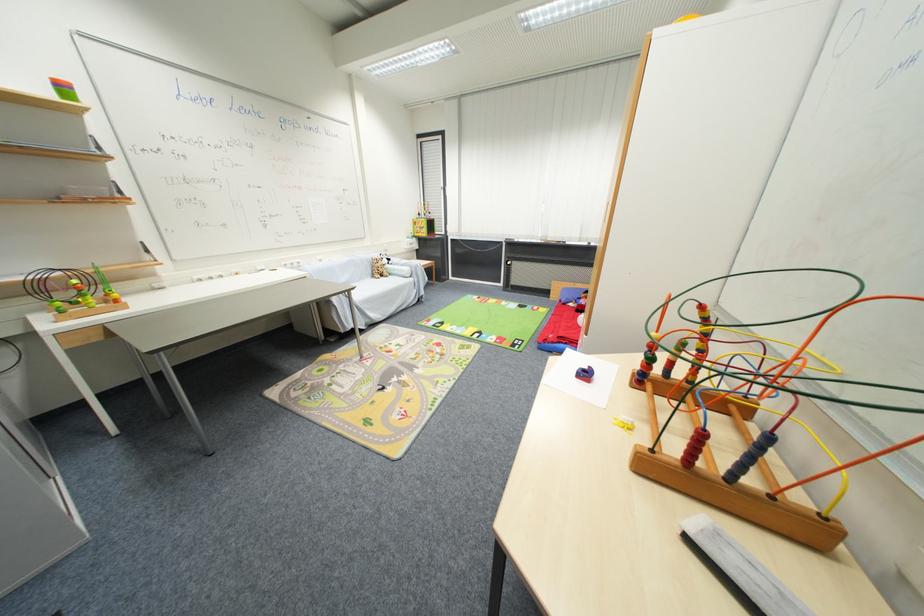
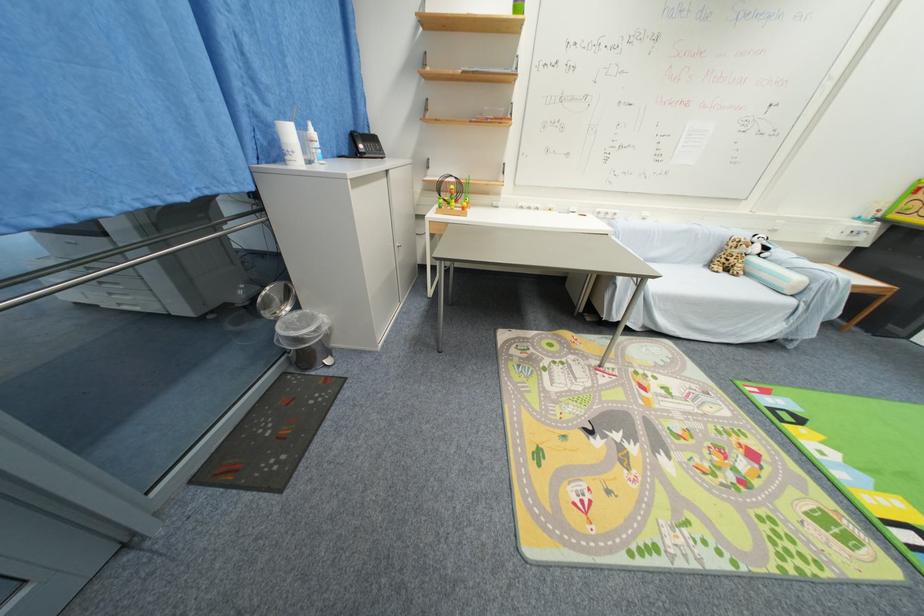
In the scene shown: First-person continuous shooting, in which direction is the camera rotating?

The rotation direction of the camera is left-down.